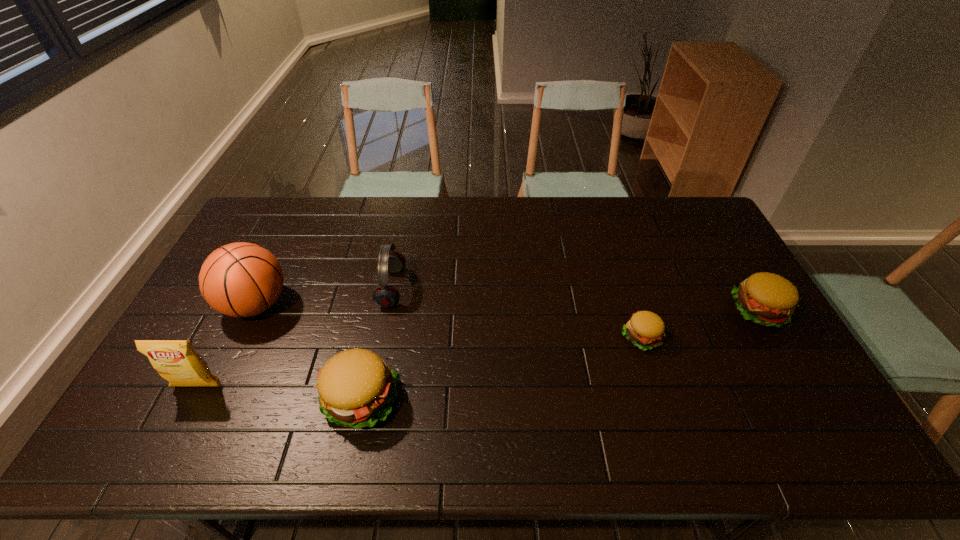
The height and width of the screenshot is (540, 960). I want to click on vacant point located 0.180m on the back of the rightmost object, so click(725, 252).

Image resolution: width=960 pixels, height=540 pixels. I want to click on vacant position located on the right of the basketball, so click(x=396, y=305).

The image size is (960, 540). I want to click on free space located 0.280m on the ear cups of the earphone, so click(x=492, y=288).

The height and width of the screenshot is (540, 960). Find the location of `hamburger positioned at the near edge`. hamburger positioned at the near edge is located at coordinates (356, 388).

What are the coordinates of `crisp (potato chip) located in the near edge section of the desktop` in the screenshot? It's located at (177, 361).

Identify the location of basketball located in the left edge section of the desktop. (241, 279).

Find the location of a particular element. The height and width of the screenshot is (540, 960). crisp (potato chip) that is at the left edge is located at coordinates (177, 361).

This screenshot has height=540, width=960. Identify the location of object present at the right edge. (767, 299).

At what (x,y) coordinates should I click in order to perform the action: click on object at the near left corner. Please return your answer as a coordinate pair (x, y). Looking at the image, I should click on (177, 361).

In the image, there is a desktop. Where is `vacant space at the far edge`? vacant space at the far edge is located at coordinates (484, 208).